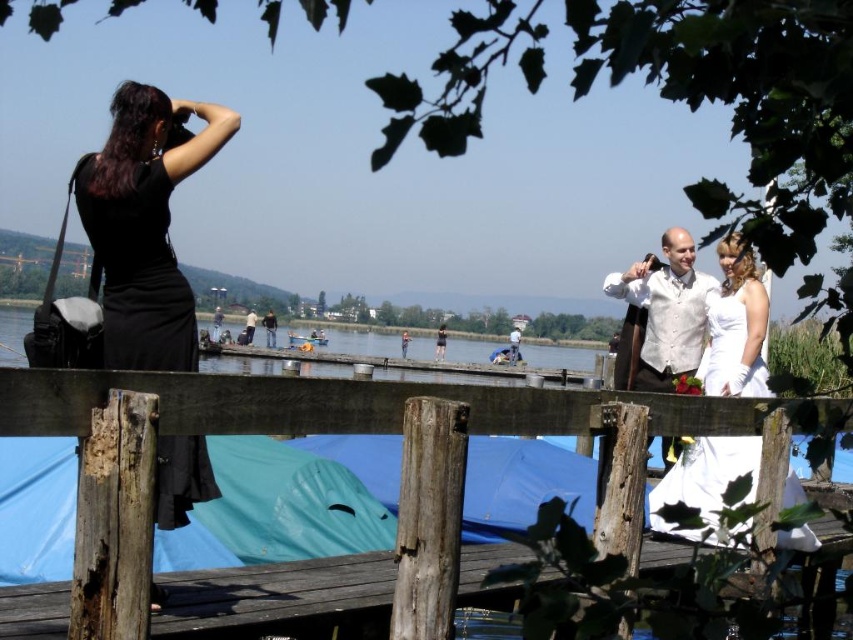
You are a photographer planning to capture a group photo of the black satin dress at left and the white satin dress at center. Which dress should you position closer to the camera to ensure both appear equally wide in the photo?

The black satin dress at left is wider than the white satin dress at center. To make them appear equally wide in the photo, position the white satin dress at center closer to the camera than the black satin dress at left.

You are a photographer trying to capture a photo of the black satin dress at left and the white satin dress at center. Based on their positions, which dress will appear larger in the photo?

The black satin dress at left will appear larger in the photo because it is much taller than the white satin dress at center.